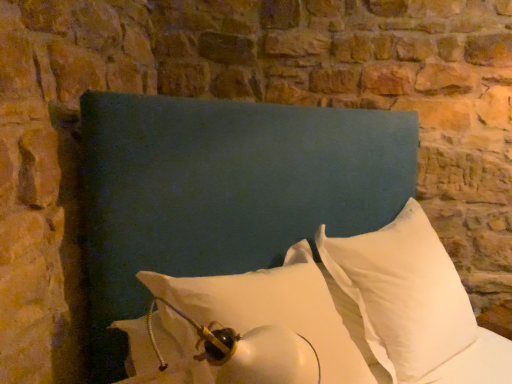
Question: From the image's perspective, is white matte pillow at center, placed as the second pillow when sorted from right to left, beneath teal fabric headboard at center?

Choices:
 (A) no
 (B) yes

Answer: (B)

Question: From a real-world perspective, does white matte pillow at center, the first pillow viewed from the left, stand above teal fabric headboard at center?

Choices:
 (A) no
 (B) yes

Answer: (A)

Question: Does white matte pillow at center, placed as the second pillow when sorted from right to left, have a greater width compared to teal fabric headboard at center?

Choices:
 (A) yes
 (B) no

Answer: (B)

Question: Is white matte pillow at center, the first pillow viewed from the left, to the left of teal fabric headboard at center from the viewer's perspective?

Choices:
 (A) no
 (B) yes

Answer: (B)

Question: Does white matte pillow at center, placed as the second pillow when sorted from right to left, have a lesser width compared to teal fabric headboard at center?

Choices:
 (A) yes
 (B) no

Answer: (A)

Question: Is white soft pillow at center, which appears as the 2th pillow when viewed from the left, taller or shorter than white matte pillow at center, the first pillow viewed from the left?

Choices:
 (A) tall
 (B) short

Answer: (A)

Question: From a real-world perspective, is white soft pillow at center, positioned as the first pillow in right-to-left order, physically located above or below white matte pillow at center, placed as the second pillow when sorted from right to left?

Choices:
 (A) above
 (B) below

Answer: (A)

Question: Is white soft pillow at center, positioned as the first pillow in right-to-left order, bigger or smaller than white matte pillow at center, the first pillow viewed from the left?

Choices:
 (A) small
 (B) big

Answer: (B)

Question: Considering the positions of white soft pillow at center, positioned as the first pillow in right-to-left order, and white matte pillow at center, placed as the second pillow when sorted from right to left, in the image, is white soft pillow at center, positioned as the first pillow in right-to-left order, wider or thinner than white matte pillow at center, placed as the second pillow when sorted from right to left,?

Choices:
 (A) thin
 (B) wide

Answer: (A)

Question: Considering the positions of white matte pillow at center, placed as the second pillow when sorted from right to left, and teal fabric headboard at center in the image, is white matte pillow at center, placed as the second pillow when sorted from right to left, taller or shorter than teal fabric headboard at center?

Choices:
 (A) short
 (B) tall

Answer: (A)

Question: Relative to teal fabric headboard at center, is white matte pillow at center, the first pillow viewed from the left, in front or behind?

Choices:
 (A) behind
 (B) front

Answer: (A)

Question: Is white matte pillow at center, the first pillow viewed from the left, to the left or to the right of teal fabric headboard at center in the image?

Choices:
 (A) left
 (B) right

Answer: (A)

Question: Is point (279, 309) closer or farther from the camera than point (440, 319)?

Choices:
 (A) farther
 (B) closer

Answer: (B)

Question: From the image's perspective, is teal fabric headboard at center positioned above or below white matte pillow at center, the first pillow viewed from the left?

Choices:
 (A) below
 (B) above

Answer: (B)

Question: Would you say teal fabric headboard at center is to the left or to the right of white matte pillow at center, the first pillow viewed from the left, in the picture?

Choices:
 (A) right
 (B) left

Answer: (A)